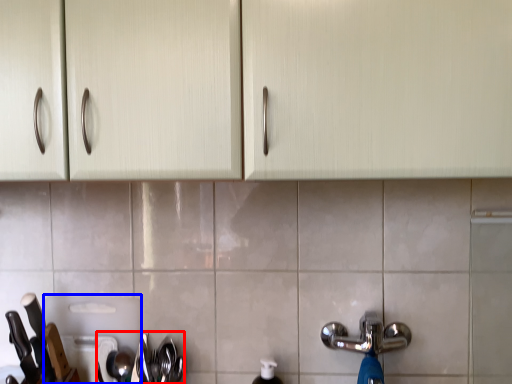
Question: Which of the following is the farthest to the observer, silverware (highlighted by a red box) or appliance (highlighted by a blue box)?

Choices:
 (A) silverware
 (B) appliance

Answer: (B)